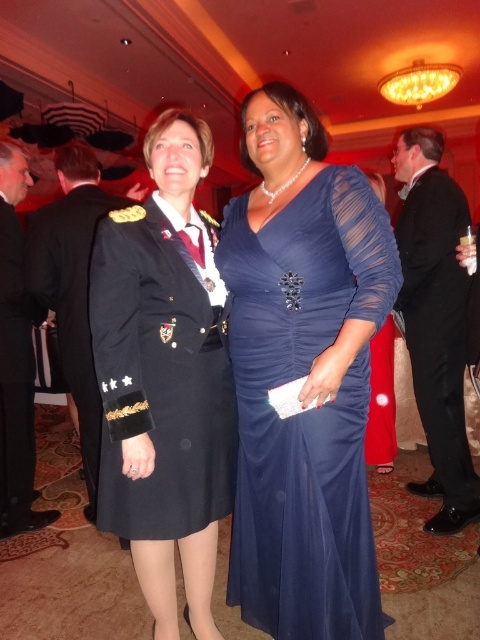
Is navy satin dress at center thinner than dark blue uniform at center?

No.

Can you confirm if navy satin dress at center is positioned below dark blue uniform at center?

Indeed, navy satin dress at center is positioned under dark blue uniform at center.

Does point (248, 276) lie behind point (93, 428)?

No, (248, 276) is closer to viewer.

Identify the location of navy satin dress at center. pos(307,410).

Does point (96, 330) lie in front of point (12, 378)?

Yes, point (96, 330) is closer to viewer.

From the picture: Between navy blue fabric uniform at left and black uniform at left, which one is positioned higher?

black uniform at left is higher up.

Identify the location of navy blue fabric uniform at left. (159, 380).

Which is behind, point (432, 150) or point (32, 256)?

Positioned behind is point (432, 150).

Which is more to the right, black satin suit at right or dark blue uniform at center?

Positioned to the right is black satin suit at right.

Between point (412, 385) and point (45, 282), which one is positioned in front?

Point (45, 282) is in front.

The width and height of the screenshot is (480, 640). I want to click on black satin suit at right, so click(435, 321).